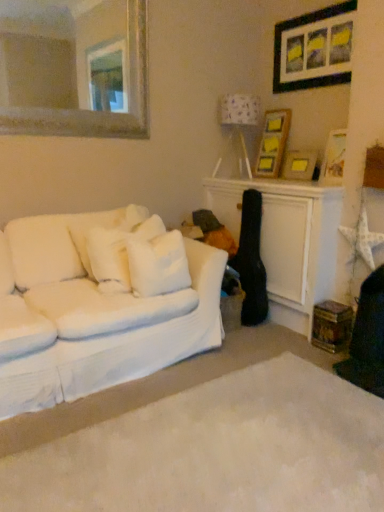
The width and height of the screenshot is (384, 512). Find the location of `vacant area on top of white soft carpet at lower center (from a real-world perspective)`. vacant area on top of white soft carpet at lower center (from a real-world perspective) is located at coordinates (250, 436).